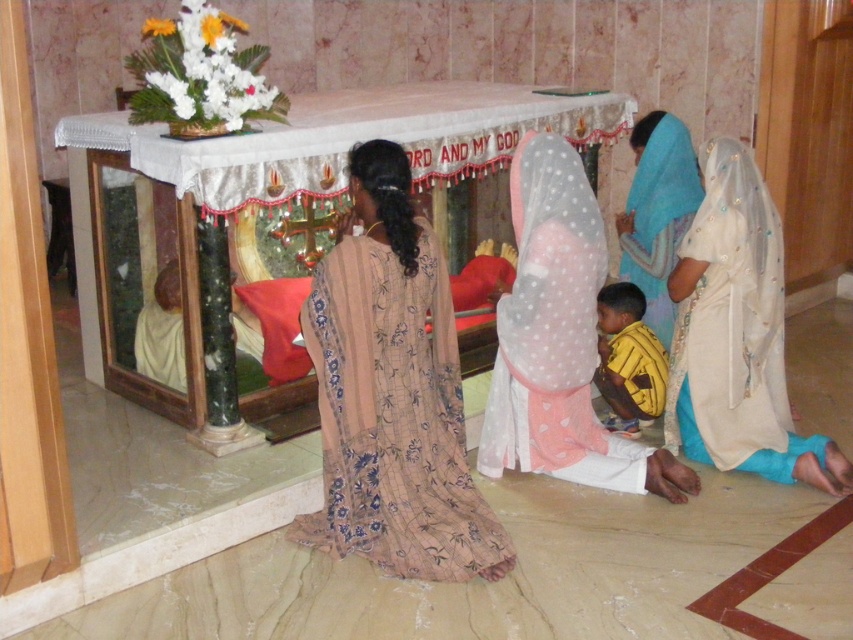
Can you confirm if beige floral dress at center is bigger than light blue sheer fabric at lower right?

Yes, beige floral dress at center is bigger than light blue sheer fabric at lower right.

Is beige floral dress at center thinner than light blue sheer fabric at lower right?

Incorrect, beige floral dress at center's width is not less than light blue sheer fabric at lower right's.

Is point (343, 483) in front of point (666, 275)?

Yes, point (343, 483) is in front of point (666, 275).

I want to click on beige floral dress at center, so click(392, 394).

Which is below, beige satin robe at lower right or yellow striped shirt at lower center?

Positioned lower is yellow striped shirt at lower center.

Is beige satin robe at lower right to the left of yellow striped shirt at lower center from the viewer's perspective?

Incorrect, beige satin robe at lower right is not on the left side of yellow striped shirt at lower center.

What do you see at coordinates (737, 336) in the screenshot?
I see `beige satin robe at lower right` at bounding box center [737, 336].

Identify the location of beige satin robe at lower right. (737, 336).

What do you see at coordinates (737, 336) in the screenshot? The width and height of the screenshot is (853, 640). I see `beige satin robe at lower right` at bounding box center [737, 336].

Based on the photo, is beige satin robe at lower right closer to the viewer compared to light blue sheer fabric at lower right?

Yes, it is.

Who is more forward, (779, 360) or (653, 131)?

Point (779, 360)

Where is `beige satin robe at lower right`? beige satin robe at lower right is located at coordinates (737, 336).